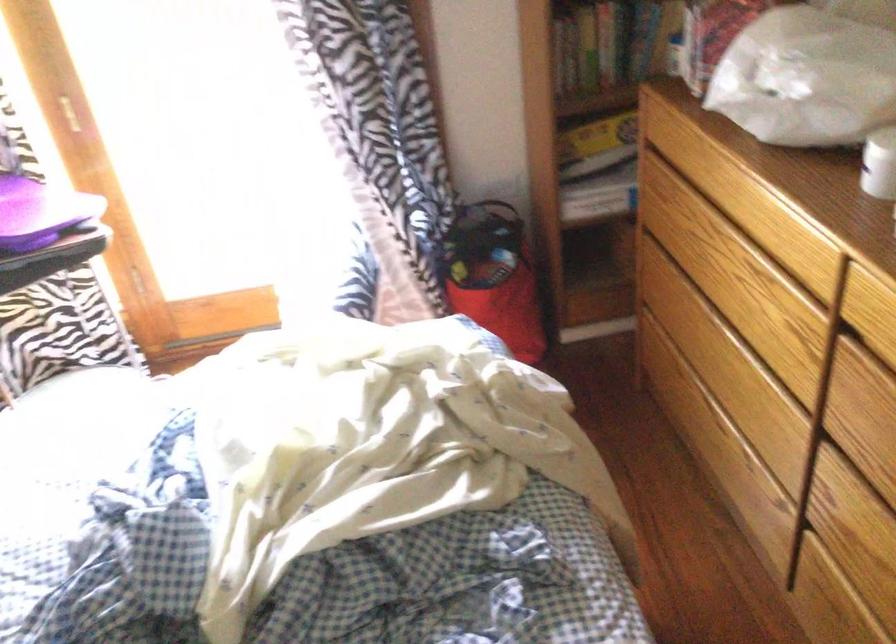
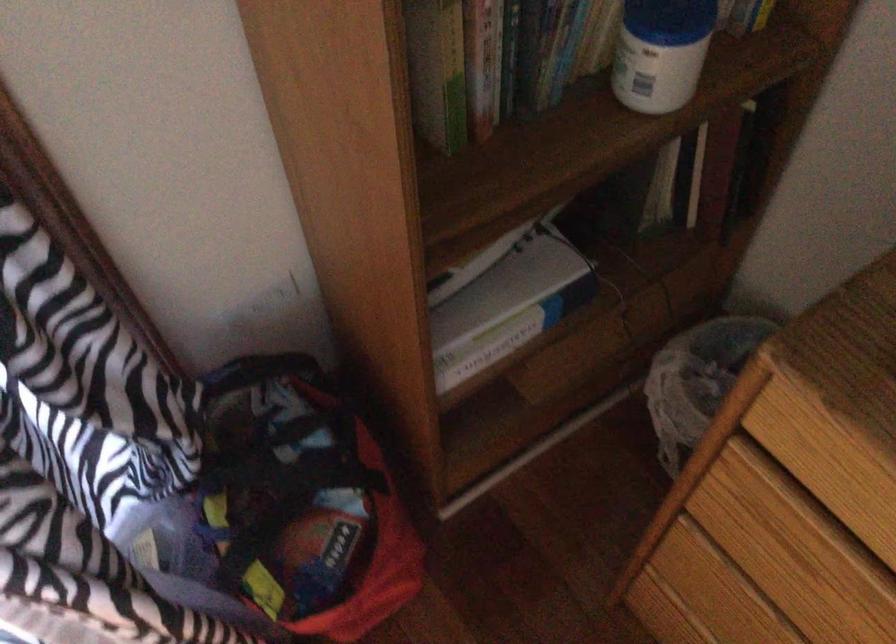
Locate, in the second image, the point that corresponds to the point at 598,190 in the first image.

(495, 345)